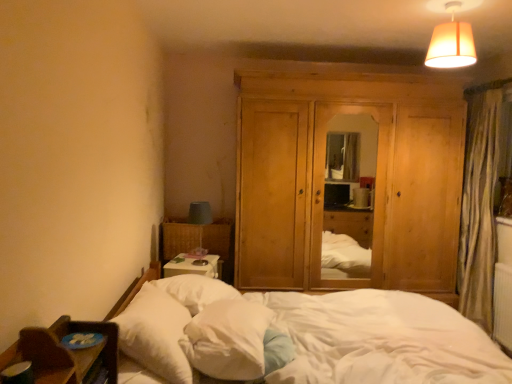
Question: Considering the relative sizes of natural wood dresser at center and white soft pillow at lower left, which ranks as the second pillow in right-to-left order, in the image provided, is natural wood dresser at center wider than white soft pillow at lower left, which ranks as the second pillow in right-to-left order,?

Choices:
 (A) yes
 (B) no

Answer: (A)

Question: Is natural wood dresser at center positioned behind white soft pillow at lower left, which appears as the first pillow when viewed from the left?

Choices:
 (A) yes
 (B) no

Answer: (A)

Question: Is natural wood dresser at center turned away from white soft pillow at lower left, which ranks as the second pillow in right-to-left order?

Choices:
 (A) yes
 (B) no

Answer: (B)

Question: From the image's perspective, is natural wood dresser at center located above white soft pillow at lower left, which ranks as the second pillow in right-to-left order?

Choices:
 (A) yes
 (B) no

Answer: (A)

Question: Does natural wood dresser at center have a lesser height compared to white soft pillow at lower left, which appears as the first pillow when viewed from the left?

Choices:
 (A) yes
 (B) no

Answer: (B)

Question: Is white soft pillow at lower left, which ranks as the second pillow in right-to-left order, in front of or behind white soft bed at lower left in the image?

Choices:
 (A) front
 (B) behind

Answer: (B)

Question: Is white soft pillow at lower left, which ranks as the second pillow in right-to-left order, to the left or to the right of white soft bed at lower left in the image?

Choices:
 (A) right
 (B) left

Answer: (B)

Question: Is white soft pillow at lower left, which appears as the first pillow when viewed from the left, situated inside white soft bed at lower left or outside?

Choices:
 (A) inside
 (B) outside

Answer: (A)

Question: From the image's perspective, relative to white soft bed at lower left, is white soft pillow at lower left, which appears as the first pillow when viewed from the left, above or below?

Choices:
 (A) above
 (B) below

Answer: (A)

Question: From the image's perspective, relative to natural wood dresser at center, is matte beige lampshade at upper right above or below?

Choices:
 (A) above
 (B) below

Answer: (A)

Question: Considering the positions of matte beige lampshade at upper right and natural wood dresser at center in the image, is matte beige lampshade at upper right wider or thinner than natural wood dresser at center?

Choices:
 (A) wide
 (B) thin

Answer: (B)

Question: In the image, is matte beige lampshade at upper right positioned in front of or behind natural wood dresser at center?

Choices:
 (A) behind
 (B) front

Answer: (B)

Question: Is matte beige lampshade at upper right inside the boundaries of natural wood dresser at center, or outside?

Choices:
 (A) inside
 (B) outside

Answer: (B)

Question: Is white soft pillow at lower left, which ranks as the second pillow in right-to-left order, inside the boundaries of white soft pillow at center, the first pillow when ordered from right to left, or outside?

Choices:
 (A) inside
 (B) outside

Answer: (B)

Question: From a real-world perspective, is white soft pillow at lower left, which appears as the first pillow when viewed from the left, above or below white soft pillow at center, the second pillow when ordered from left to right?

Choices:
 (A) below
 (B) above

Answer: (B)